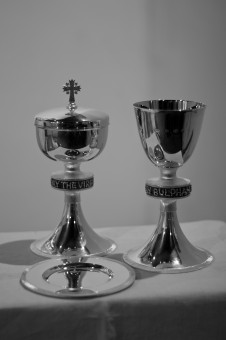
The width and height of the screenshot is (226, 340). Find the location of `stem of glass`. stem of glass is located at coordinates (172, 203), (74, 195).